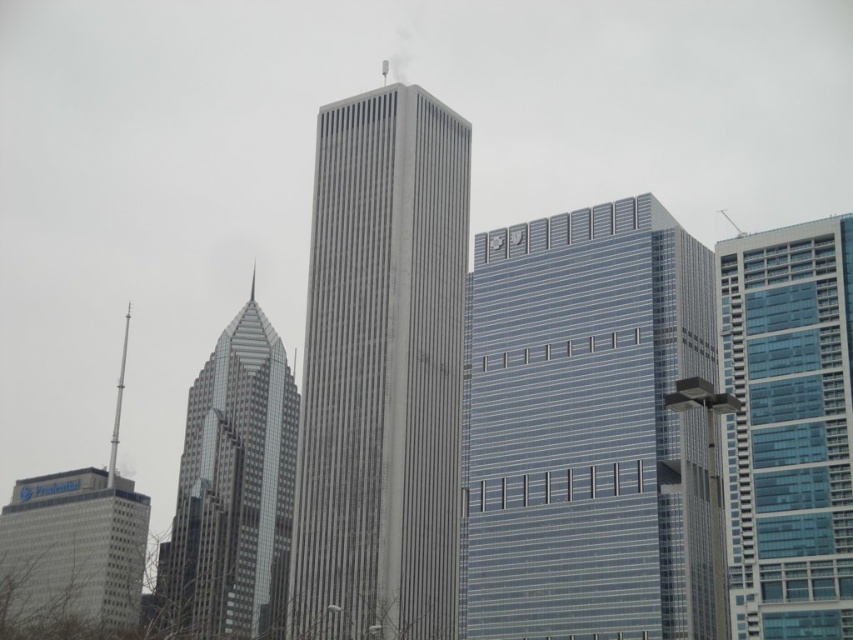
Question: Which point appears closest to the camera in this image?

Choices:
 (A) click(131, 602)
 (B) click(809, 394)
 (C) click(426, 220)
 (D) click(511, 625)

Answer: (B)

Question: Is gray concrete skyscraper at center thinner than glassy silver skyscraper at left?

Choices:
 (A) yes
 (B) no

Answer: (A)

Question: Which object is the farthest from the glassy blue skyscraper at center?

Choices:
 (A) glassy silver skyscraper at left
 (B) gray concrete building at lower left

Answer: (B)

Question: Considering the real-world distances, which object is farthest from the blue glass building at right?

Choices:
 (A) gray concrete building at lower left
 (B) gray concrete skyscraper at center
 (C) glassy blue skyscraper at center
 (D) glassy silver skyscraper at left

Answer: (A)

Question: Can you confirm if gray concrete skyscraper at center is positioned to the left of glassy silver skyscraper at left?

Choices:
 (A) yes
 (B) no

Answer: (B)

Question: Is glassy silver skyscraper at left further to camera compared to gray concrete building at lower left?

Choices:
 (A) no
 (B) yes

Answer: (A)